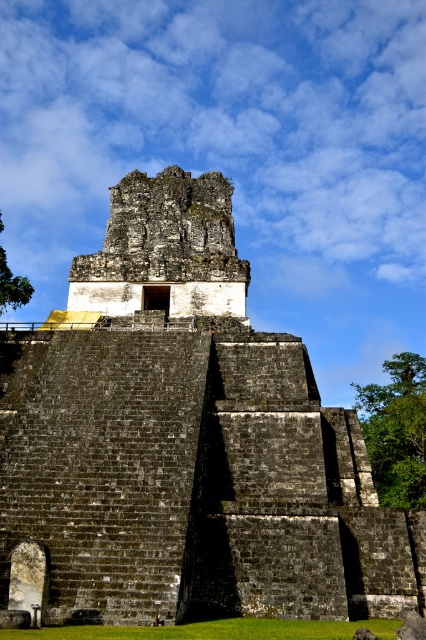
Which is in front, point (325, 595) or point (164, 209)?

Point (325, 595) is in front.

Can you confirm if dark gray stone ruins at center is bigger than rough stone tower at center?

Yes.

Is point (273, 534) positioned after point (134, 260)?

No, (273, 534) is closer to viewer.

Identify the location of dark gray stone ruins at center. This screenshot has width=426, height=640. (184, 442).